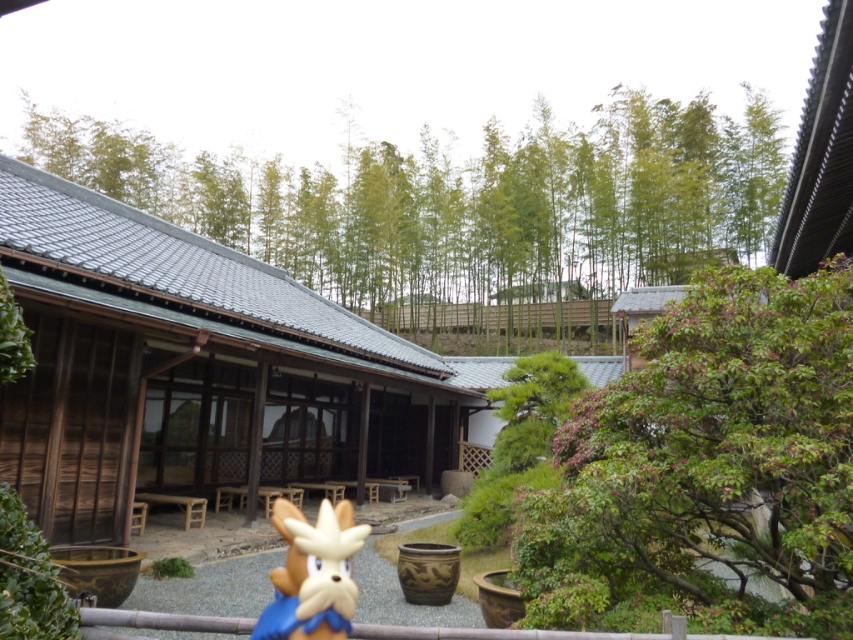
Who is shorter, brown plush toy at center or brown wooden rail at lower center?

brown wooden rail at lower center

Can you confirm if brown plush toy at center is positioned to the right of brown wooden rail at lower center?

Incorrect, brown plush toy at center is not on the right side of brown wooden rail at lower center.

In order to click on brown plush toy at center in this screenshot , I will do `click(312, 573)`.

At what (x,y) coordinates should I click in order to perform the action: click on brown plush toy at center. Please return your answer as a coordinate pair (x, y). Looking at the image, I should click on (312, 573).